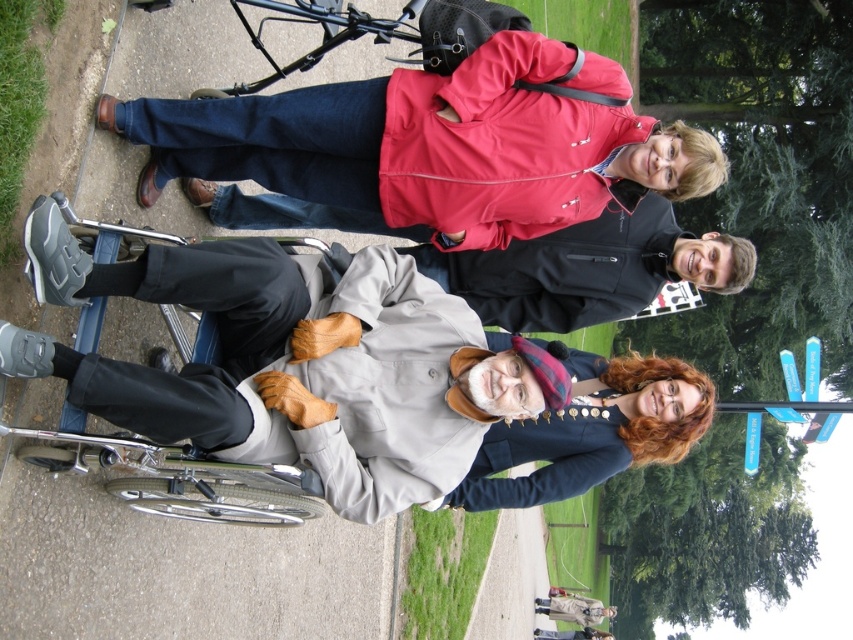
Question: Does gray concrete pavement at lower left appear on the left side of matte red jacket at upper center?

Choices:
 (A) no
 (B) yes

Answer: (B)

Question: Which point is farther from the camera taking this photo?

Choices:
 (A) (9, 573)
 (B) (503, 477)
 (C) (534, 232)
 (D) (262, 362)

Answer: (B)

Question: Is light gray fabric wheelchair at center thinner than smooth navy blue coat at lower right?

Choices:
 (A) yes
 (B) no

Answer: (B)

Question: Can you confirm if matte red jacket at upper center is thinner than smooth navy blue coat at lower right?

Choices:
 (A) no
 (B) yes

Answer: (A)

Question: Considering the real-world distances, which object is closest to the smooth navy blue coat at lower right?

Choices:
 (A) light gray fabric wheelchair at center
 (B) matte red jacket at upper center
 (C) gray concrete pavement at lower left

Answer: (A)

Question: Which of these objects is positioned closest to the smooth navy blue coat at lower right?

Choices:
 (A) matte red jacket at upper center
 (B) light gray fabric wheelchair at center
 (C) gray concrete pavement at lower left

Answer: (B)